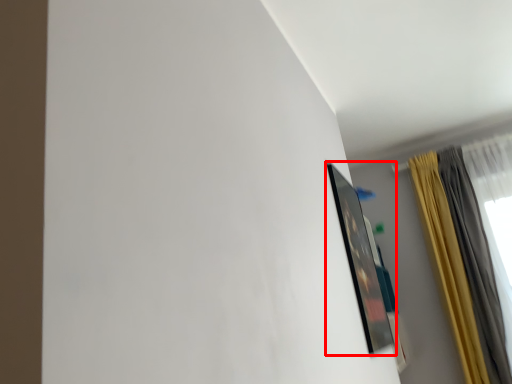
Question: From the image's perspective, where is picture frame (annotated by the red box) located relative to curtain?

Choices:
 (A) below
 (B) above

Answer: (B)